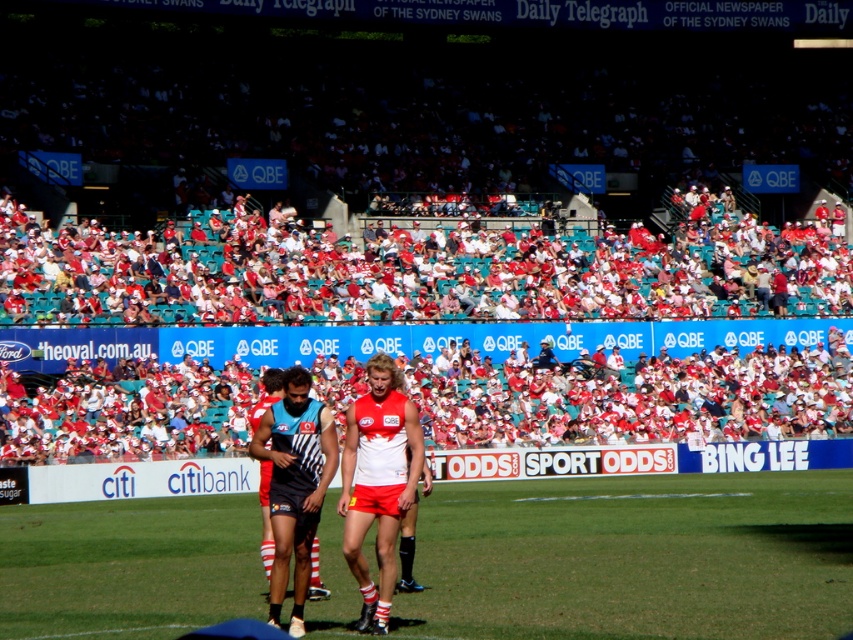
Question: Which of the following is the farthest from the observer?

Choices:
 (A) (114, 442)
 (B) (279, 525)
 (C) (15, 582)
 (D) (363, 452)

Answer: (A)

Question: Which object is the closest to the red fabric seats at upper center?

Choices:
 (A) red jersey at center
 (B) green grass at center
 (C) matte black uniform at center

Answer: (A)

Question: Observing the image, what is the correct spatial positioning of red jersey at center in reference to matte black uniform at center?

Choices:
 (A) left
 (B) right

Answer: (B)

Question: Is red fabric seats at upper center further to camera compared to matte black uniform at center?

Choices:
 (A) no
 (B) yes

Answer: (B)

Question: Among these objects, which one is farthest from the camera?

Choices:
 (A) red fabric seats at upper center
 (B) red jersey at center
 (C) matte black uniform at center

Answer: (A)

Question: Does red fabric seats at upper center appear on the right side of green grass at center?

Choices:
 (A) yes
 (B) no

Answer: (A)